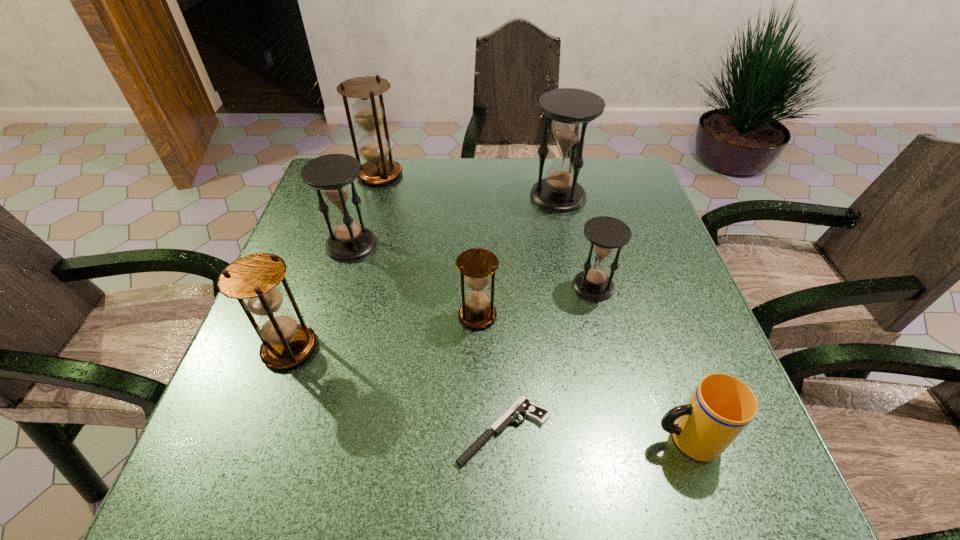
I want to click on free point located 0.170m on the side of the seventh tallest object with the handle, so [x=550, y=438].

Where is `vacant space positioned on the front-facing side of the black pistol`? This screenshot has height=540, width=960. vacant space positioned on the front-facing side of the black pistol is located at coordinates (270, 431).

Locate an element on the screen. This screenshot has width=960, height=540. free spot located 0.100m on the front-facing side of the black pistol is located at coordinates (398, 431).

Find the location of a particular element. The image size is (960, 540). vacant space located 0.160m on the front-facing side of the black pistol is located at coordinates (363, 431).

In order to click on cup situated at the near edge in this screenshot , I will do `click(721, 407)`.

Find the location of `pistol that is at the near edge`. pistol that is at the near edge is located at coordinates (523, 405).

This screenshot has height=540, width=960. In order to click on hourglass that is at the right edge in this screenshot , I will do `click(605, 233)`.

Where is `cup that is positioned at the right edge`? This screenshot has width=960, height=540. cup that is positioned at the right edge is located at coordinates (721, 407).

Identify the location of object that is positioned at the far left corner. (374, 147).

Locate an element on the screen. This screenshot has width=960, height=540. object situated at the near right corner is located at coordinates (721, 407).